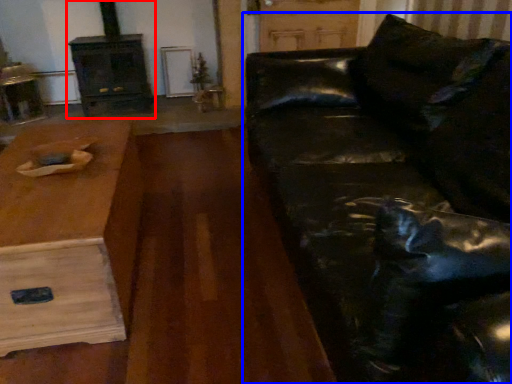
Question: Which object is further to the camera taking this photo, fireplace (highlighted by a red box) or studio couch (highlighted by a blue box)?

Choices:
 (A) fireplace
 (B) studio couch

Answer: (A)